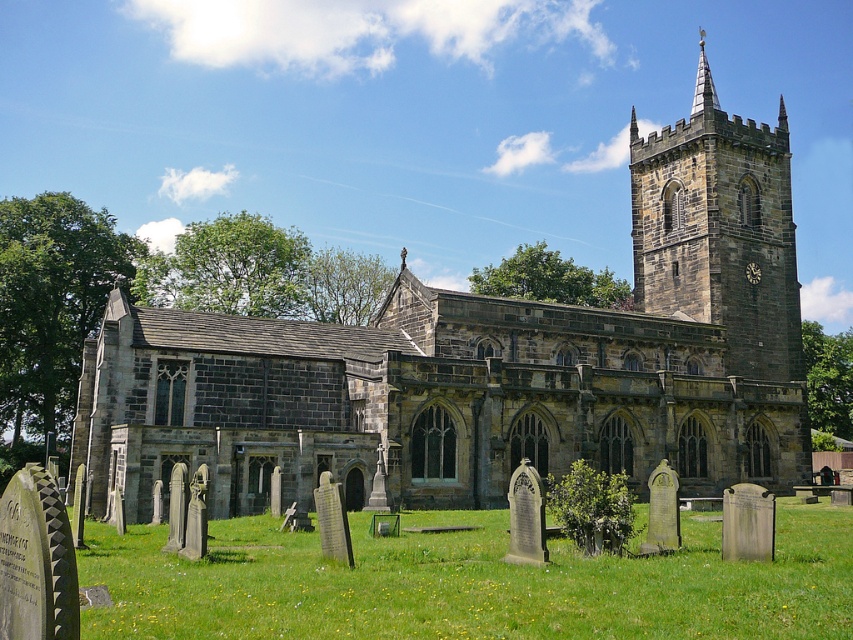
You are standing in front of the historic stone church and looking at the graveyard. You notice two points marked on the ground at coordinates point (722, 147) and point (257, 557). Which point is closer to you?

Point (722, 147) is further to the camera than point (257, 557), so the closer point to you is point (257, 557).

You are standing in the graveyard of the historic stone church and want to take a photo of the dark gray stone tower at upper right. To get the best shot, you need to position yourself where the green grass at lower center is between you and the tower. Is this possible?

Yes, because the green grass at lower center is in front of the dark gray stone tower at upper right, positioning yourself there would place the grass between you and the tower, allowing for the desired composition.

You are standing in the graveyard and want to determine which object is closer to the ground. Based on the scene, which one is lower in height between the green grass at lower center and the dark gray stone tower at upper right?

The green grass at lower center is shorter than the dark gray stone tower at upper right, so the green grass at lower center is closer to the ground.